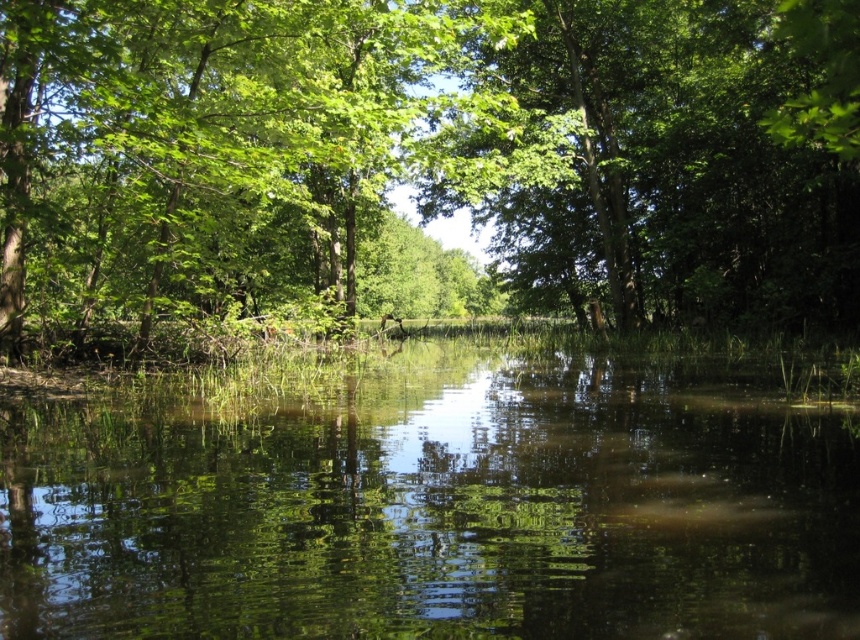
You are standing in the forest and see a point marked at coordinates [427,160]. What does this point represent?

The point at coordinates [427,160] represents a green leafy tree at center.

You are a bird looking for a place to perch. You see the green leafy tree at center and the green reflective water at center. Which one is taller?

The green leafy tree at center is much taller than the green reflective water at center, so the tree is taller.